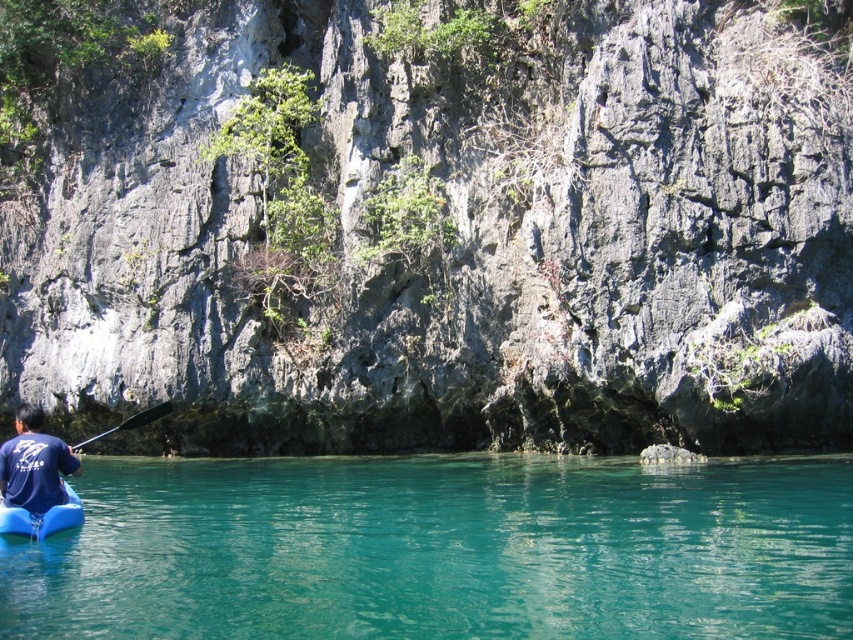
Can you confirm if teal glossy water at lower center is wider than black rubber paddle at lower left?

Correct, the width of teal glossy water at lower center exceeds that of black rubber paddle at lower left.

The width and height of the screenshot is (853, 640). What do you see at coordinates (442, 548) in the screenshot?
I see `teal glossy water at lower center` at bounding box center [442, 548].

Find the location of a particular element. The width and height of the screenshot is (853, 640). teal glossy water at lower center is located at coordinates (442, 548).

Is teal glossy water at lower center positioned behind blue rubber canoe at lower left?

No.

Does teal glossy water at lower center appear over blue rubber canoe at lower left?

Actually, teal glossy water at lower center is below blue rubber canoe at lower left.

I want to click on teal glossy water at lower center, so click(x=442, y=548).

Based on the photo, which is below, gray rock cliff at upper center or black rubber paddle at lower left?

black rubber paddle at lower left is below.

Which of these two, gray rock cliff at upper center or black rubber paddle at lower left, stands shorter?

Standing shorter between the two is black rubber paddle at lower left.

Is point (695, 156) less distant than point (82, 442)?

Yes, point (695, 156) is closer to viewer.

You are a GUI agent. You are given a task and a screenshot of the screen. Output one action in this format:
    pyautogui.click(x=<x>, y=<y>)
    Task: Click on the gray rock cliff at upper center
    
    Given the screenshot: What is the action you would take?
    pyautogui.click(x=451, y=237)